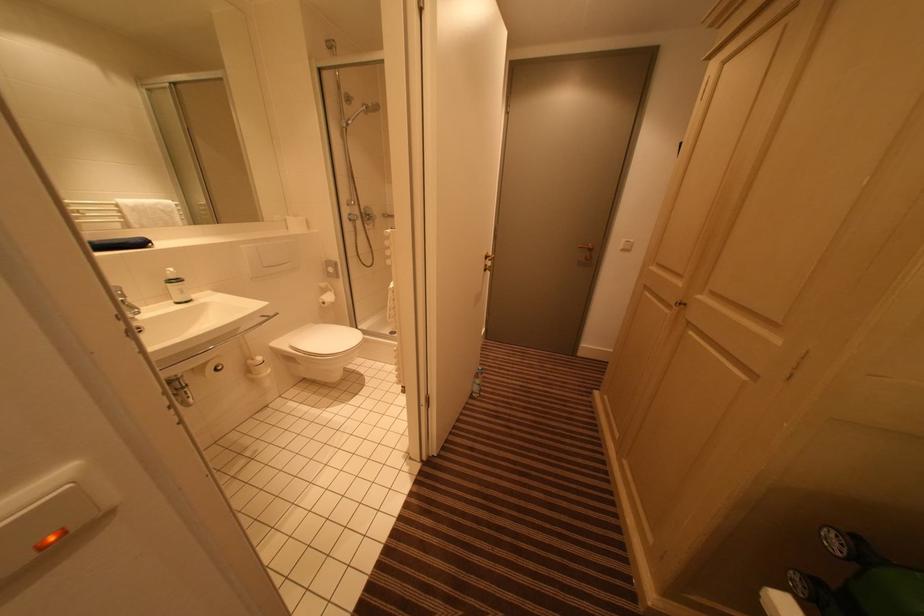
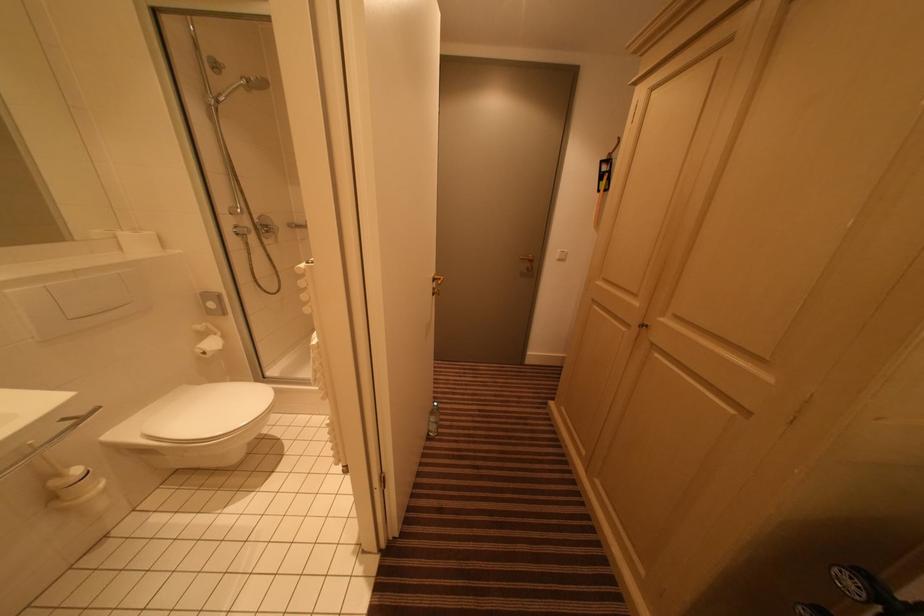
Question: The first image is from the beginning of the video and the second image is from the end. How did the camera likely rotate when shooting the video?

Choices:
 (A) Left
 (B) Right
 (C) Up
 (D) Down

Answer: (B)